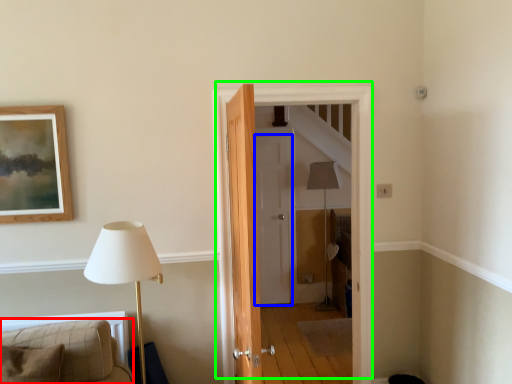
Question: Which object is positioned closest to furniture (highlighted by a red box)? Select from door (highlighted by a blue box) and door (highlighted by a green box).

Choices:
 (A) door
 (B) door

Answer: (B)